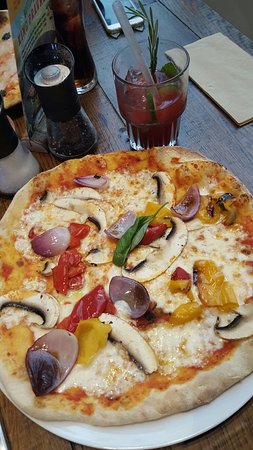
I want to click on glass, so [x=164, y=115].